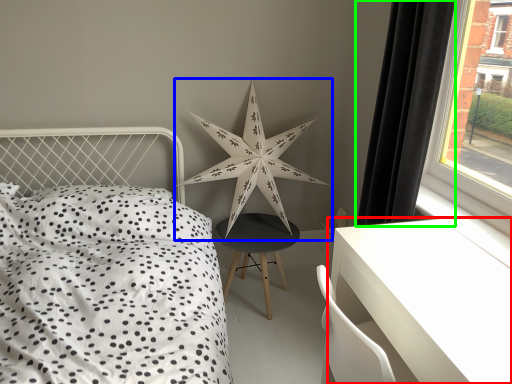
Question: Which is nearer to the table (highlighted by a red box)? star (highlighted by a blue box) or curtain (highlighted by a green box).

Choices:
 (A) star
 (B) curtain

Answer: (B)